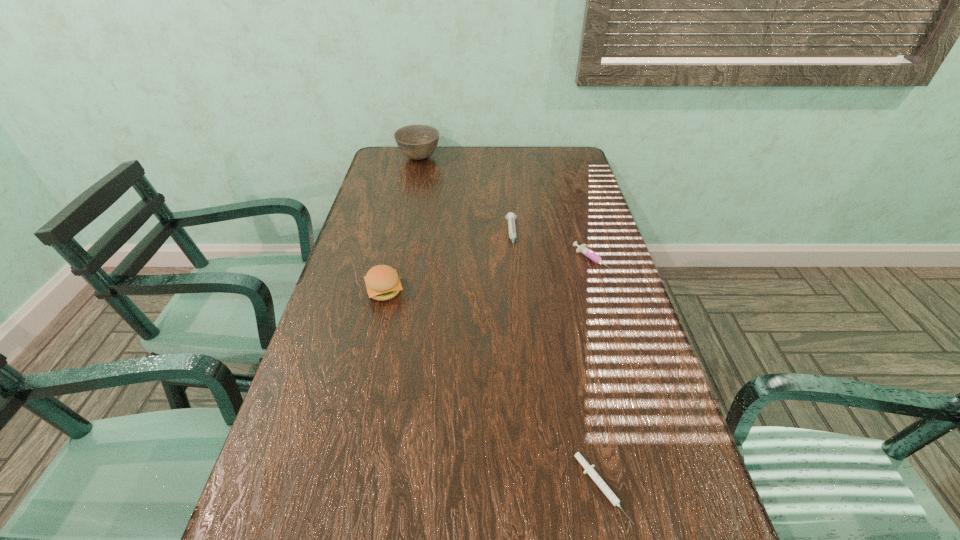
Where is `the tallest object`? This screenshot has width=960, height=540. the tallest object is located at coordinates click(417, 142).

This screenshot has width=960, height=540. What are the coordinates of `bowl` in the screenshot? It's located at (417, 142).

Where is `the fourth farthest object`? the fourth farthest object is located at coordinates (382, 281).

Find the location of `hamburger`. hamburger is located at coordinates [382, 281].

Locate an element on the screen. The width and height of the screenshot is (960, 540). the third object from right to left is located at coordinates (511, 217).

Image resolution: width=960 pixels, height=540 pixels. I want to click on the rightmost syringe, so click(583, 249).

Image resolution: width=960 pixels, height=540 pixels. I want to click on the second syringe from right to left, so click(592, 473).

At what (x,y) coordinates should I click in order to perform the action: click on the shortest object. Please return your answer as a coordinate pair (x, y). The image size is (960, 540). Looking at the image, I should click on (592, 473).

Find the location of a particular element. The image size is (960, 540). vacant space located 0.320m on the right of the farthest object is located at coordinates (x=522, y=158).

The width and height of the screenshot is (960, 540). Identify the location of blank space located on the back of the second tallest object. (399, 228).